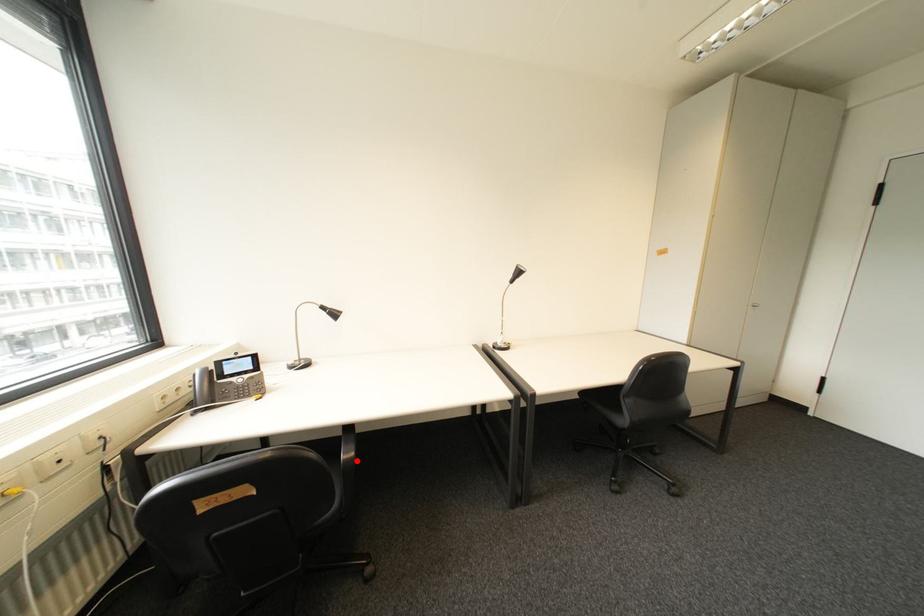
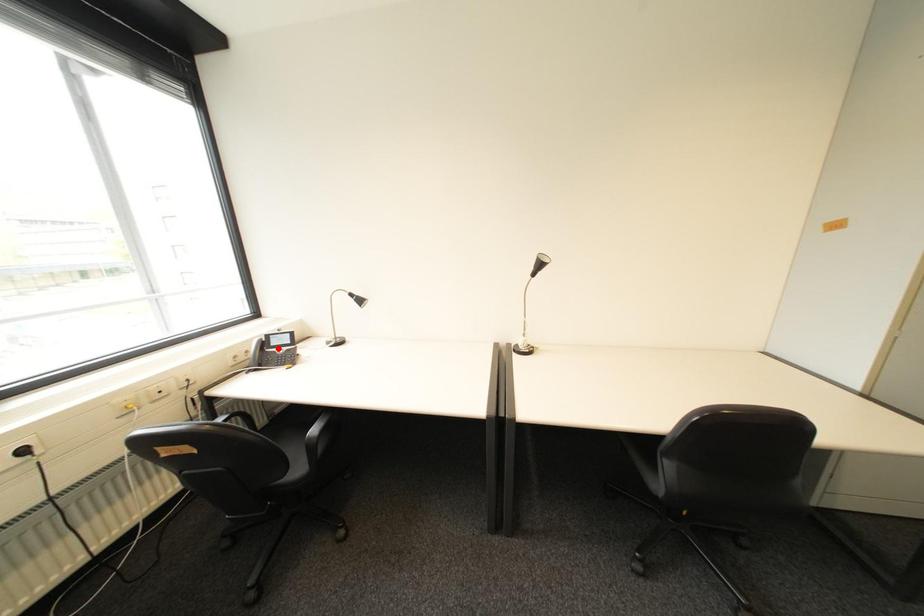
I am providing you with two images of the same scene from different viewpoints. A red point is marked on the first image and another point is marked on the second image. Is the red point in image1 aligned with the point shown in image2?

No